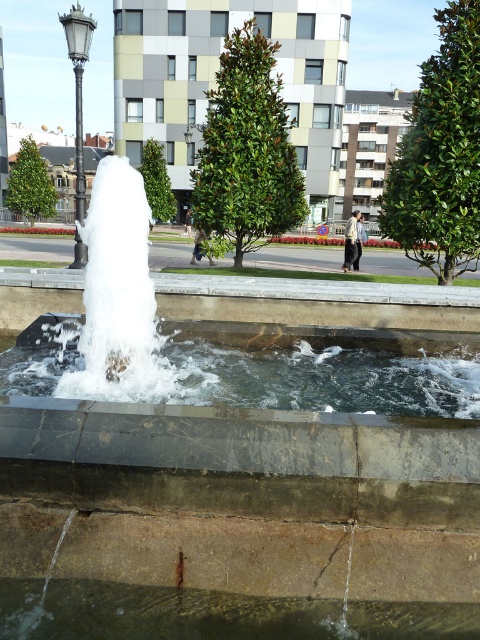
Question: Among these objects, which one is nearest to the camera?

Choices:
 (A) clear water at center
 (B) polished metal lamp post at upper left

Answer: (A)

Question: Does clear water at center appear over polished metal lamp post at upper left?

Choices:
 (A) no
 (B) yes

Answer: (A)

Question: Which point is closer to the camera taking this photo?

Choices:
 (A) (81, 32)
 (B) (206, 348)

Answer: (B)

Question: Among these objects, which one is farthest from the camera?

Choices:
 (A) clear water at center
 (B) polished metal lamp post at upper left

Answer: (B)

Question: Does clear water at center have a smaller size compared to polished metal lamp post at upper left?

Choices:
 (A) no
 (B) yes

Answer: (B)

Question: Can you confirm if clear water at center is positioned to the right of polished metal lamp post at upper left?

Choices:
 (A) yes
 (B) no

Answer: (A)